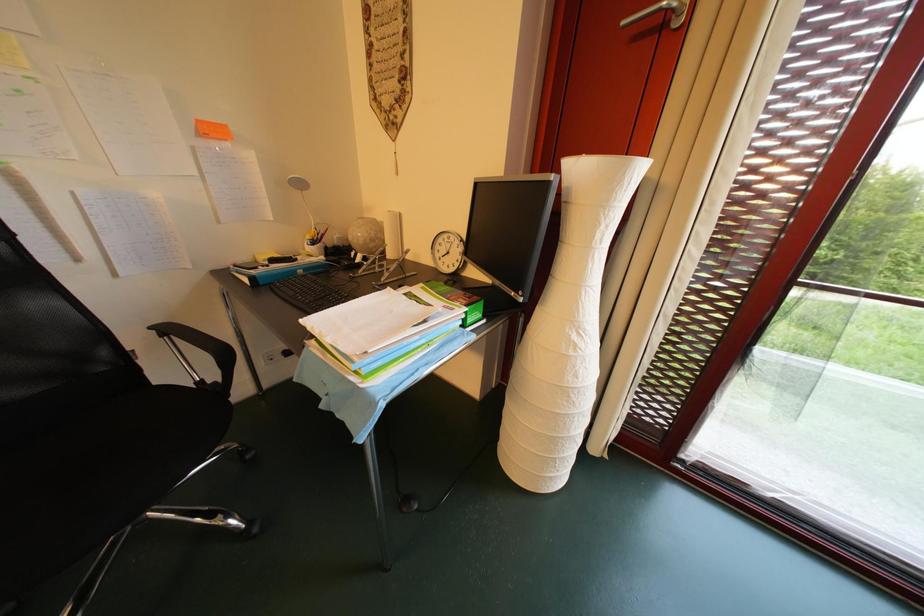
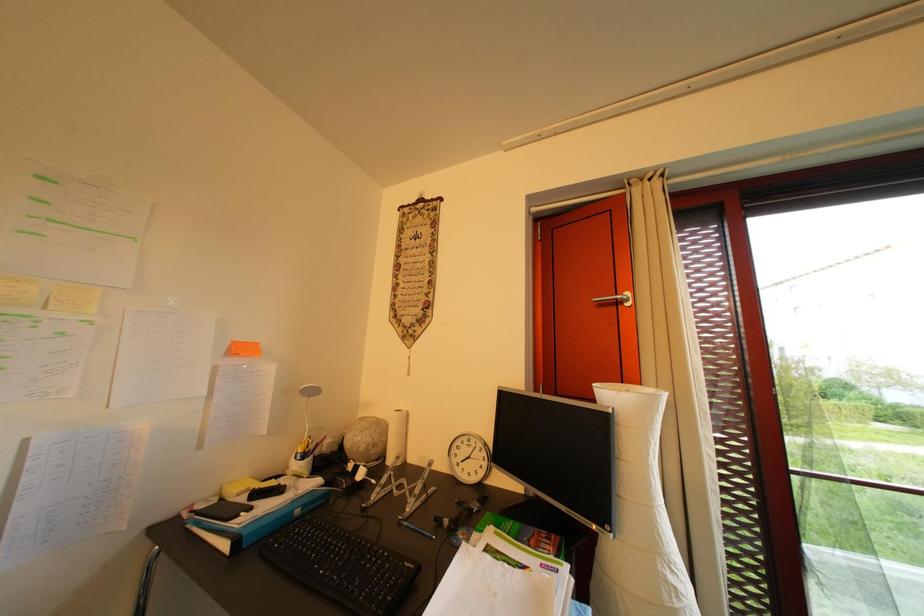
How did the camera likely rotate?

The camera's rotation is toward right-up.